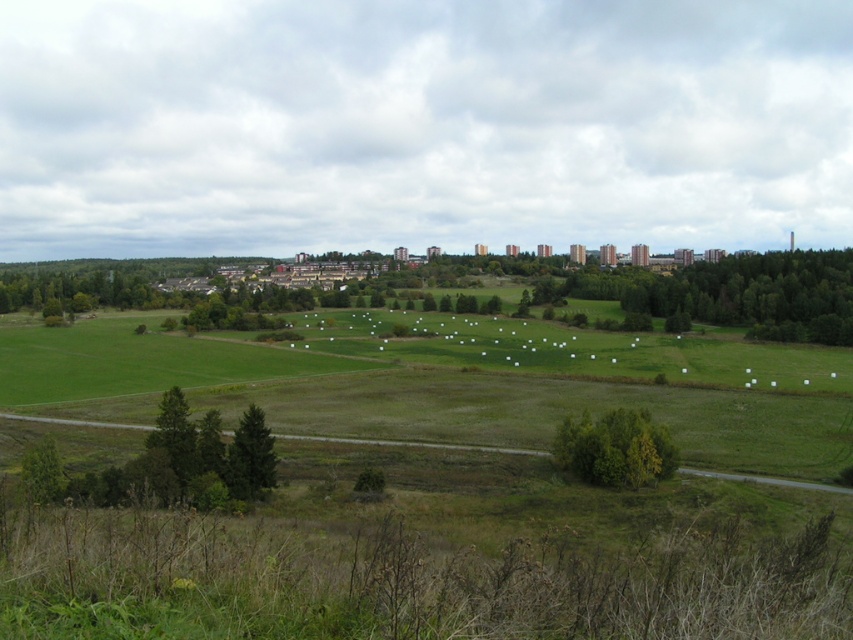
Question: Is green leafy tree at center in front of green leafy tree at lower left?

Choices:
 (A) yes
 (B) no

Answer: (B)

Question: Estimate the real-world distances between objects in this image. Which object is farther from the green matte tree at lower left?

Choices:
 (A) green leafy tree at lower left
 (B) green leafy tree at center

Answer: (B)

Question: Can you confirm if green matte trees at lower left is thinner than green leafy tree at lower left?

Choices:
 (A) no
 (B) yes

Answer: (A)

Question: Among these objects, which one is nearest to the camera?

Choices:
 (A) green matte tree at lower left
 (B) green leafy tree at center

Answer: (A)

Question: Does green matte trees at lower left lie behind green leafy tree at lower left?

Choices:
 (A) yes
 (B) no

Answer: (B)

Question: Based on their relative distances, which object is farther from the green leafy tree at center?

Choices:
 (A) green matte tree at lower left
 (B) green leafy tree at lower left

Answer: (B)